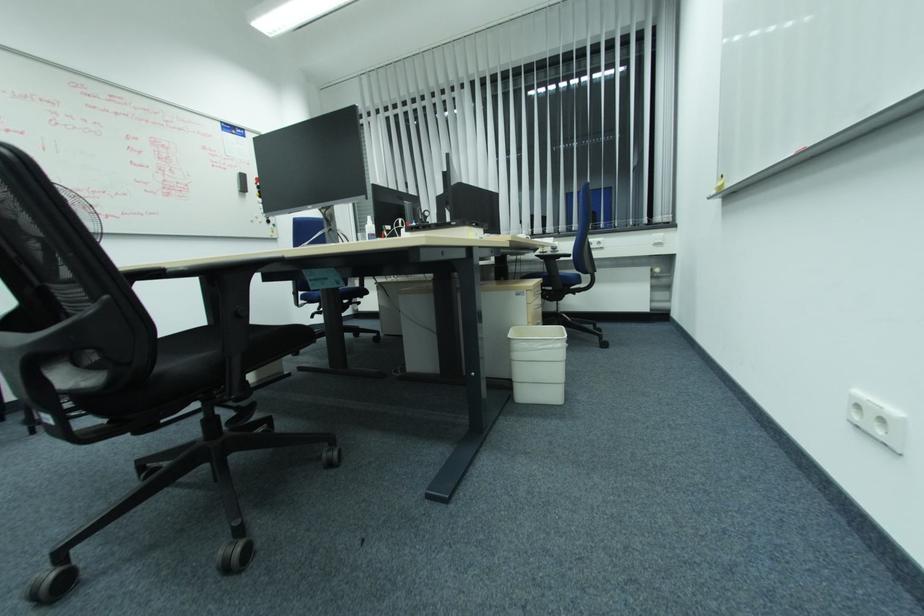
Which object does [242,183] point to?

It corresponds to the whiteboard eraser in the image.